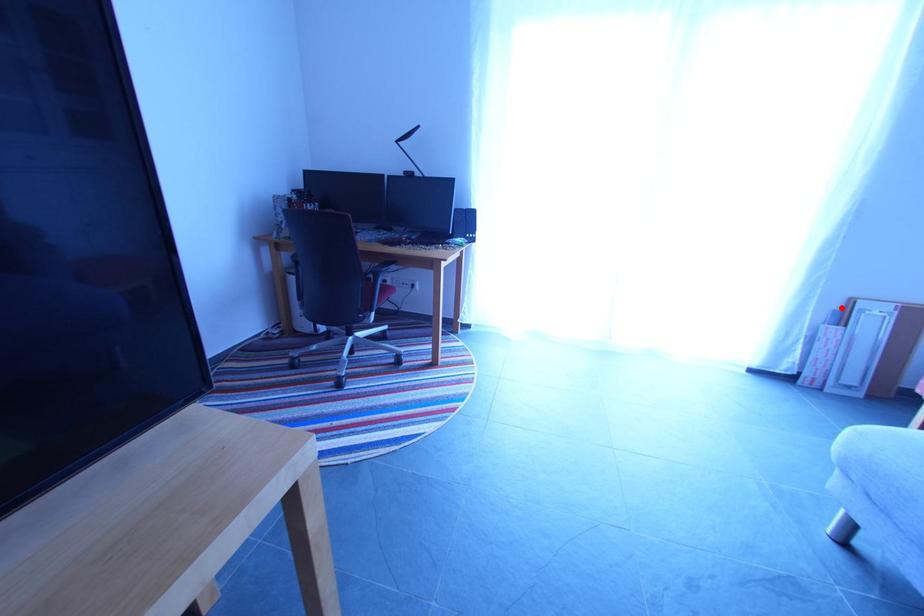
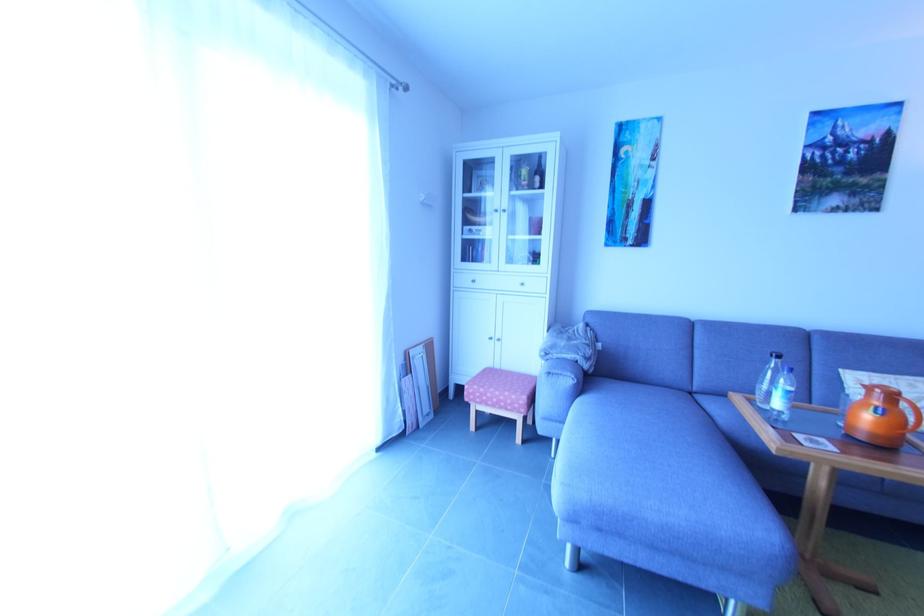
The point at the highlighted location is marked in the first image. Where is the corresponding point in the second image?

(406, 362)